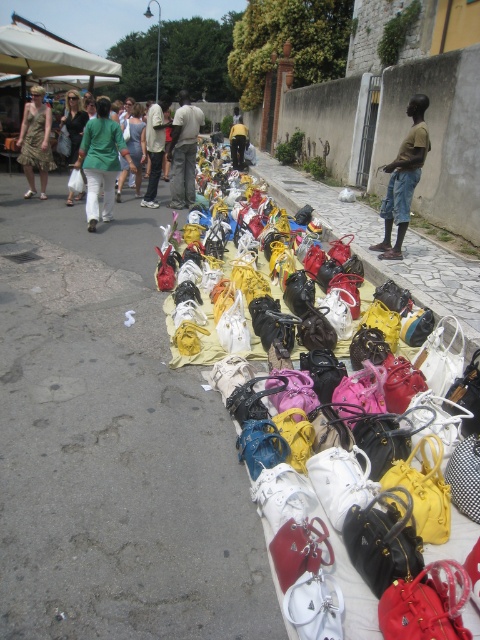
You are a customer at the market and want to pick up both the light brown leather pants at center and the matte black bag at center. How far apart are these two items from each other?

The light brown leather pants at center and the matte black bag at center are 8.66 meters apart.

Looking at this image, you are a customer at the market and want to pick up the brown matte shirt at center and the light brown leather pants at center. Which item is closer to your current position?

The brown matte shirt at center is closer to the viewer than the light brown leather pants at center, so the brown matte shirt at center is closer to your current position.

You are a customer at the market and want to pick up both the light brown leather pants at center and the matte black bag at center. Which item should you reach for first to avoid bending over too much?

You should reach for the light brown leather pants at center first since it is closer to you than the matte black bag at center, requiring less bending.